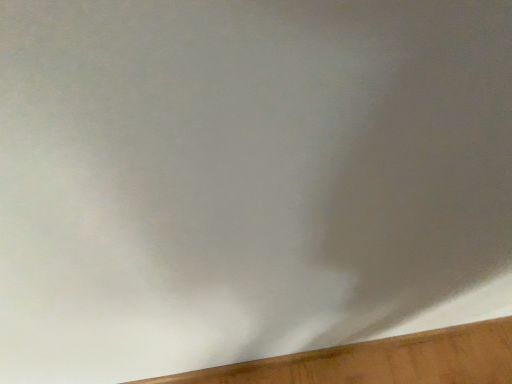
Locate an element on the screen. The height and width of the screenshot is (384, 512). wooden floor at bottom is located at coordinates (380, 361).

What is the approximate height of wooden floor at bottom?

The height of wooden floor at bottom is 1.98 inches.

In order to face wooden floor at bottom, should I rotate leftwards or rightwards?

Turn right approximately 11.600 degrees to face it.

What do you see at coordinates (380, 361) in the screenshot? I see `wooden floor at bottom` at bounding box center [380, 361].

Find the location of a particular element. The width and height of the screenshot is (512, 384). wooden floor at bottom is located at coordinates (380, 361).